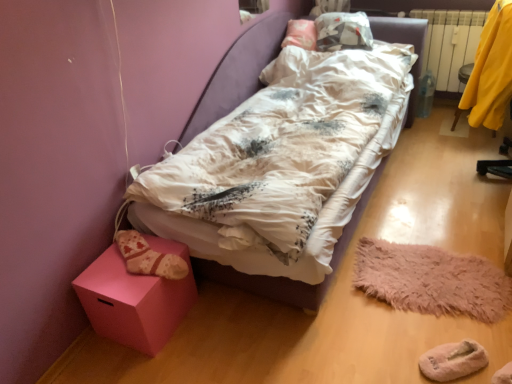
This screenshot has height=384, width=512. Describe the element at coordinates (137, 291) in the screenshot. I see `pink matte cube at lower left` at that location.

Find the location of a particular element. Image resolution: width=512 pixels, height=384 pixels. fuzzy pink mat at lower right is located at coordinates (432, 280).

Looking at this image, what is the approximate width of knitted woolen sock at lower left?

knitted woolen sock at lower left is 14.82 inches wide.

Measure the distance between point (426, 31) and camera.

Point (426, 31) is 2.99 meters from camera.

The width and height of the screenshot is (512, 384). I want to click on pink matte cube at lower left, so click(137, 291).

In the scene shown: From a real-world perspective, is pink matte cube at lower left positioned above or below fuzzy pink mat at lower right?

In terms of real-world spatial position, pink matte cube at lower left is above fuzzy pink mat at lower right.

Could you tell me if pink matte cube at lower left is facing fuzzy pink mat at lower right?

No, pink matte cube at lower left is not aimed at fuzzy pink mat at lower right.

How different are the orientations of pink matte cube at lower left and fuzzy pink mat at lower right in degrees?

The angular difference between pink matte cube at lower left and fuzzy pink mat at lower right is 83.2 degrees.

In the image, there is a pink matte cube at lower left. Where is `mat below it (from a real-world perspective)`? mat below it (from a real-world perspective) is located at coordinates [x=432, y=280].

Image resolution: width=512 pixels, height=384 pixels. In order to click on clothing on the right of fuzzy pink mat at lower right in this screenshot , I will do `click(490, 71)`.

Between fuzzy pink mat at lower right and yellow fabric at right, which one has smaller size?

fuzzy pink mat at lower right.

In the image, is fuzzy pink mat at lower right on the left side or the right side of yellow fabric at right?

Clearly, fuzzy pink mat at lower right is on the left of yellow fabric at right in the image.

Does white cotton bed at center have a greater height compared to fuzzy pink mat at lower right?

Indeed, white cotton bed at center has a greater height compared to fuzzy pink mat at lower right.

Can you confirm if white cotton bed at center is smaller than fuzzy pink mat at lower right?

No.

Who is more distant, white cotton bed at center or fuzzy pink mat at lower right?

fuzzy pink mat at lower right is behind.

Is knitted woolen sock at lower left turned away from fuzzy pink mat at lower right?

knitted woolen sock at lower left does not have its back to fuzzy pink mat at lower right.

Considering the relative sizes of knitted woolen sock at lower left and fuzzy pink mat at lower right in the image provided, is knitted woolen sock at lower left smaller than fuzzy pink mat at lower right?

Yes, knitted woolen sock at lower left is smaller than fuzzy pink mat at lower right.

Which of these two, knitted woolen sock at lower left or fuzzy pink mat at lower right, is wider?

fuzzy pink mat at lower right.

Between yellow fabric at right and knitted woolen sock at lower left, which one has larger width?

With larger width is knitted woolen sock at lower left.

Is yellow fabric at right far away from knitted woolen sock at lower left?

Indeed, yellow fabric at right is not near knitted woolen sock at lower left.

Could you tell me if yellow fabric at right is turned towards knitted woolen sock at lower left?

No, yellow fabric at right is not facing towards knitted woolen sock at lower left.

From the image's perspective, which one is positioned lower, yellow fabric at right or knitted woolen sock at lower left?

knitted woolen sock at lower left.

Is pink matte cube at lower left far from white cotton bed at center?

No, pink matte cube at lower left is not far from white cotton bed at center.

Which is more to the right, pink matte cube at lower left or white cotton bed at center?

Positioned to the right is white cotton bed at center.

From a real-world perspective, does pink matte cube at lower left sit lower than white cotton bed at center?

Yes, from a real-world perspective, pink matte cube at lower left is below white cotton bed at center.

Find the location of a particular element. The image size is (512, 384). furniture on the left of white cotton bed at center is located at coordinates (137, 291).

Is pink matte cube at lower left wider than white plastic radiator at right?

Yes.

Which object is closer to the camera taking this photo, pink matte cube at lower left or white plastic radiator at right?

pink matte cube at lower left.

Image resolution: width=512 pixels, height=384 pixels. Identify the location of furniture that is below the white plastic radiator at right (from the image's perspective). (137, 291).

Locate an element on the screen. The image size is (512, 384). furniture on the left of fuzzy pink mat at lower right is located at coordinates (137, 291).

Where is `clothing on the right of fuzzy pink mat at lower right`? This screenshot has height=384, width=512. clothing on the right of fuzzy pink mat at lower right is located at coordinates (490, 71).

Looking at the image, which one is located further to yellow fabric at right, white plastic radiator at right or pink matte cube at lower left?

Based on the image, pink matte cube at lower left appears to be further to yellow fabric at right.

Which object lies further to the anchor point pink matte cube at lower left, yellow fabric at right or knitted woolen sock at lower left?

yellow fabric at right is positioned further to the anchor pink matte cube at lower left.

Looking at the image, which one is located further to fuzzy pink mat at lower right, white plastic radiator at right or pink matte cube at lower left?

Among the two, white plastic radiator at right is located further to fuzzy pink mat at lower right.

Looking at the image, which one is located closer to white cotton bed at center, white plastic radiator at right or pink matte cube at lower left?

The object closer to white cotton bed at center is pink matte cube at lower left.

Looking at the image, which one is located closer to yellow fabric at right, fuzzy pink mat at lower right or knitted woolen sock at lower left?

Based on the image, fuzzy pink mat at lower right appears to be nearer to yellow fabric at right.

Based on their spatial positions, is white cotton bed at center or knitted woolen sock at lower left further from pink matte cube at lower left?

white cotton bed at center is further to pink matte cube at lower left.

Considering their positions, is yellow fabric at right positioned further to white cotton bed at center than fuzzy pink mat at lower right?

Based on the image, fuzzy pink mat at lower right appears to be further to white cotton bed at center.

Considering their positions, is pink matte cube at lower left positioned closer to white cotton bed at center than knitted woolen sock at lower left?

pink matte cube at lower left.

The height and width of the screenshot is (384, 512). In order to click on clothing between knitted woolen sock at lower left and white plastic radiator at right in the horizontal direction in this screenshot , I will do `click(490, 71)`.

Where is `shoe between pink matte cube at lower left and white plastic radiator at right in the horizontal direction`? The height and width of the screenshot is (384, 512). shoe between pink matte cube at lower left and white plastic radiator at right in the horizontal direction is located at coordinates (148, 257).

Locate an element on the screen. Image resolution: width=512 pixels, height=384 pixels. shoe between white cotton bed at center and pink matte cube at lower left in the vertical direction is located at coordinates [x=148, y=257].

This screenshot has height=384, width=512. I want to click on bed between pink matte cube at lower left and fuzzy pink mat at lower right in the horizontal direction, so click(x=238, y=72).